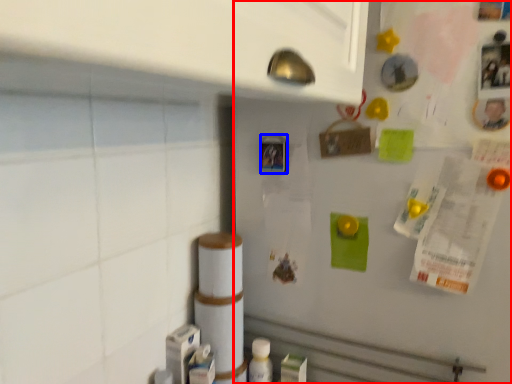
Question: Which object appears closest to the camera in this image, fridge (highlighted by a red box) or button (highlighted by a blue box)?

Choices:
 (A) fridge
 (B) button

Answer: (A)